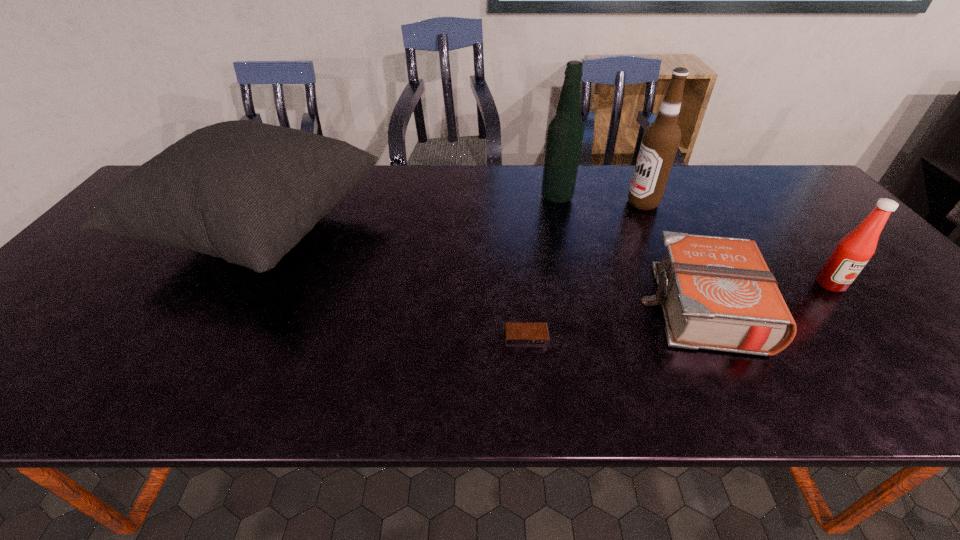
This screenshot has width=960, height=540. Identify the location of object that is the second closest to the condiment. (661, 139).

You are a GUI agent. You are given a task and a screenshot of the screen. Output one action in this format:
    pyautogui.click(x=<x>, y=<y>)
    Task: Click on the vacant region that satisfies the following two spatial constraints: 1. on the label of the right alcohol; 2. on the back side of the Bible
    
    Given the screenshot: What is the action you would take?
    pyautogui.click(x=693, y=307)

Where is `vacant region that satisfies the following two spatial constraints: 1. on the label of the right alcohol; 2. on the front face of the shortest object`? The height and width of the screenshot is (540, 960). vacant region that satisfies the following two spatial constraints: 1. on the label of the right alcohol; 2. on the front face of the shortest object is located at coordinates (708, 338).